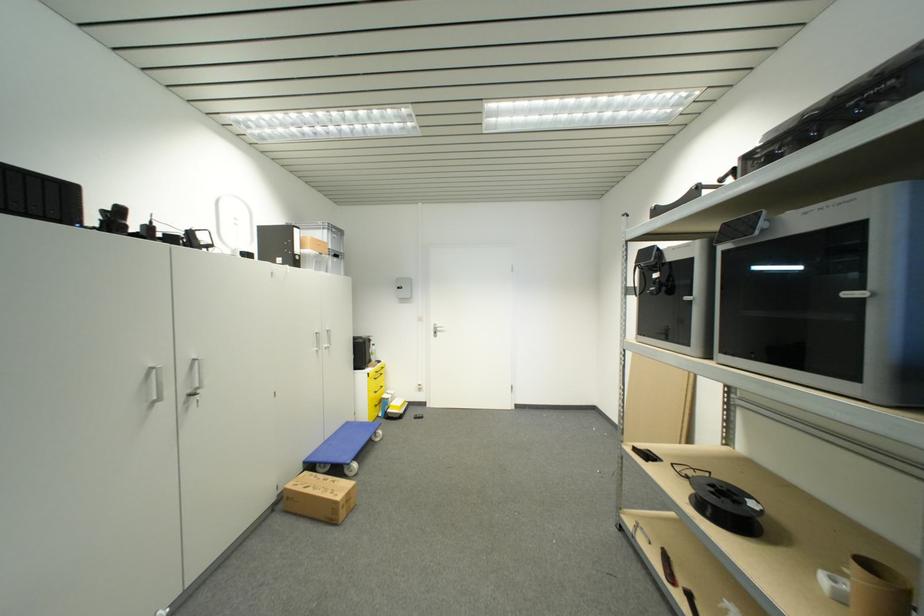
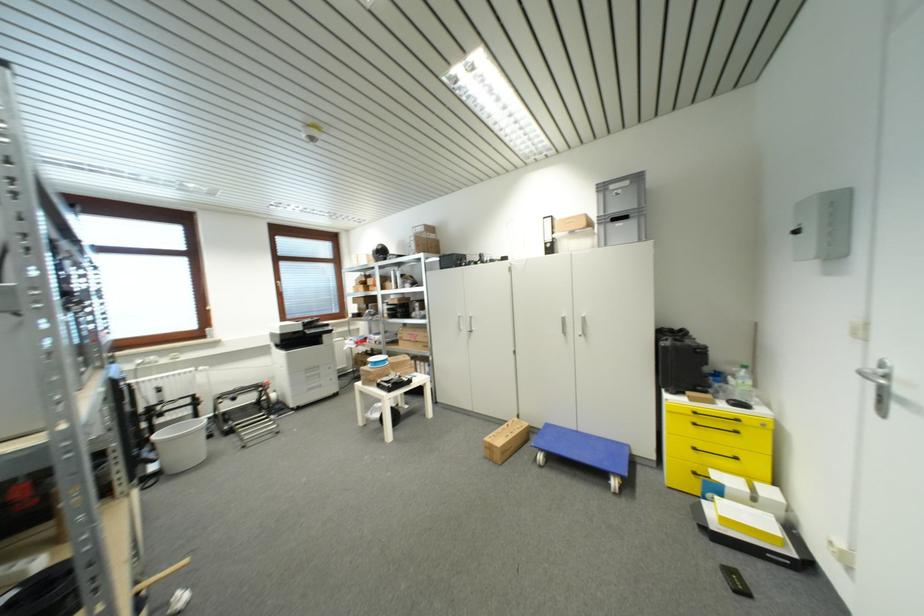
The point at (444, 334) is marked in the first image. Where is the corresponding point in the second image?

(909, 405)